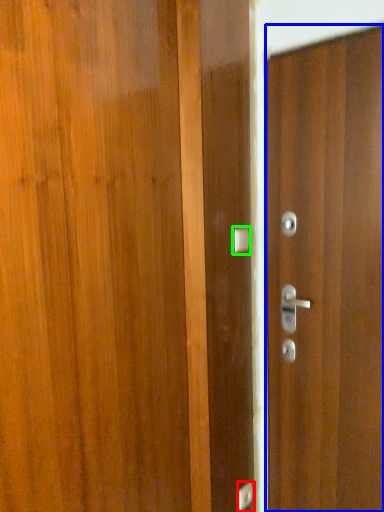
Question: Which is nearer to the door handle (highlighted by a red box)? door (highlighted by a blue box) or door handle (highlighted by a green box).

Choices:
 (A) door
 (B) door handle

Answer: (A)